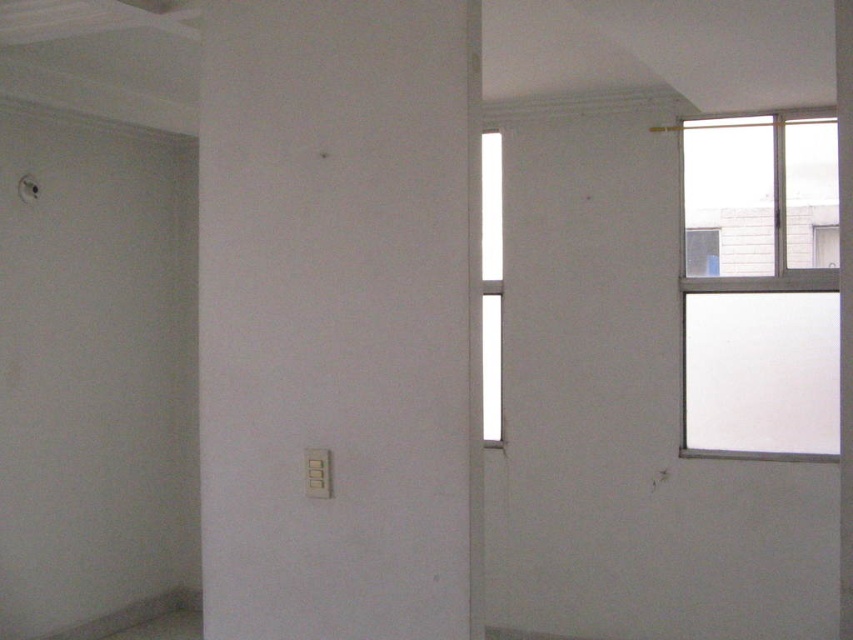
Is point (734, 428) positioned before point (496, 289)?

Yes, point (734, 428) is closer to viewer.

Can you confirm if transparent glass window at upper right is shorter than white glass window at center?

Yes, transparent glass window at upper right is shorter than white glass window at center.

Looking at this image, who is more distant from viewer, (830, 305) or (486, 176)?

The point (486, 176) is behind.

Where is `transparent glass window at upper right`? The image size is (853, 640). transparent glass window at upper right is located at coordinates (759, 284).